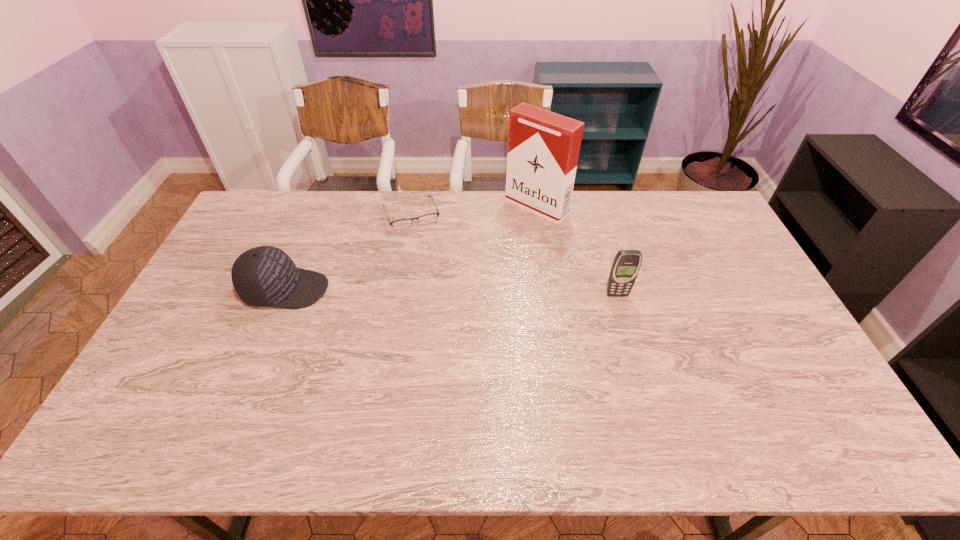
You are a GUI agent. You are given a task and a screenshot of the screen. Output one action in this format:
    pyautogui.click(x=<x>, y=<y>)
    Task: Click on the vacant spot on the desktop that is between the baseball cap and the second tallest object and is positioned on the front-facing side of the spectacles
    
    Given the screenshot: What is the action you would take?
    pyautogui.click(x=440, y=292)

I want to click on free space on the desktop that is between the baseball cap and the cellular telephone and is positioned on the front-facing side of the cigarette_case, so click(x=439, y=292).